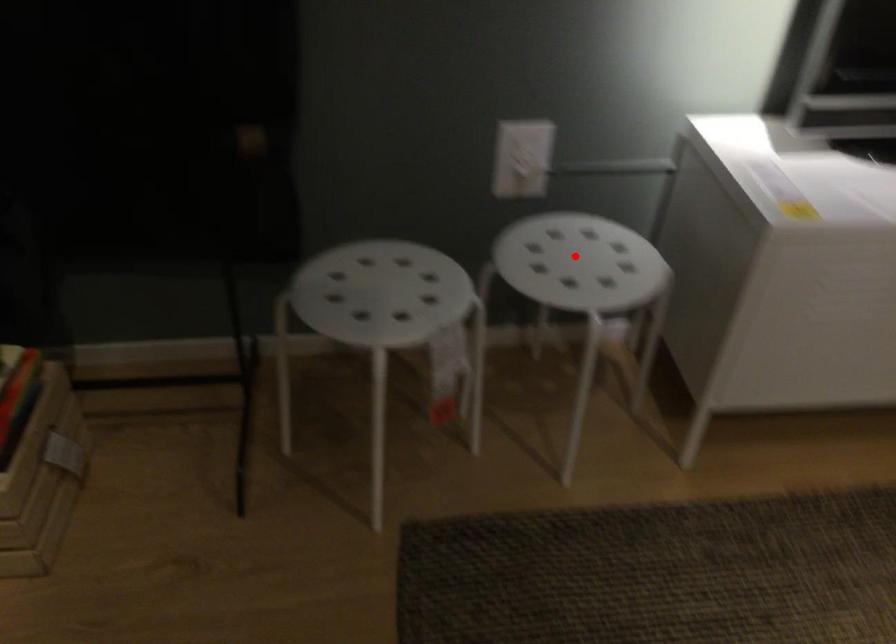
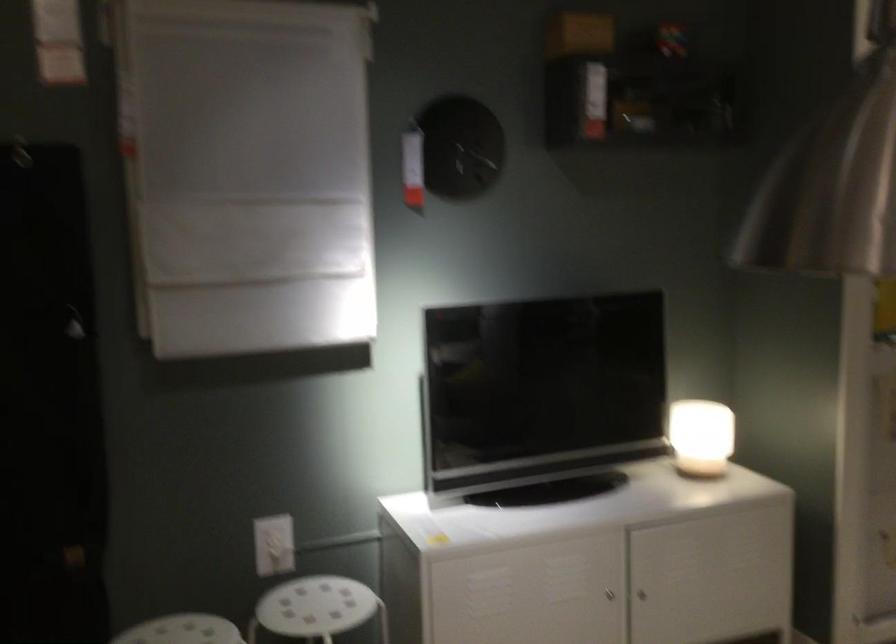
In the second image, find the point that corresponds to the highlighted location in the first image.

(315, 607)